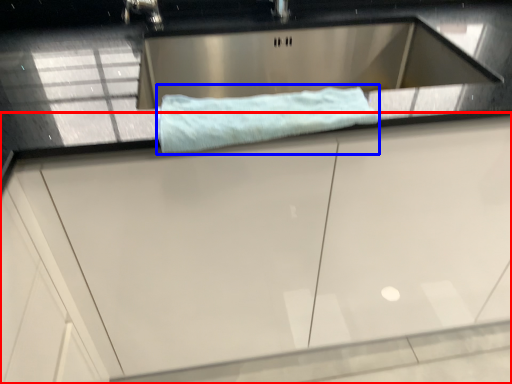
Question: Which object is further to the camera taking this photo, cabinetry (highlighted by a red box) or bath towel (highlighted by a blue box)?

Choices:
 (A) cabinetry
 (B) bath towel

Answer: (B)